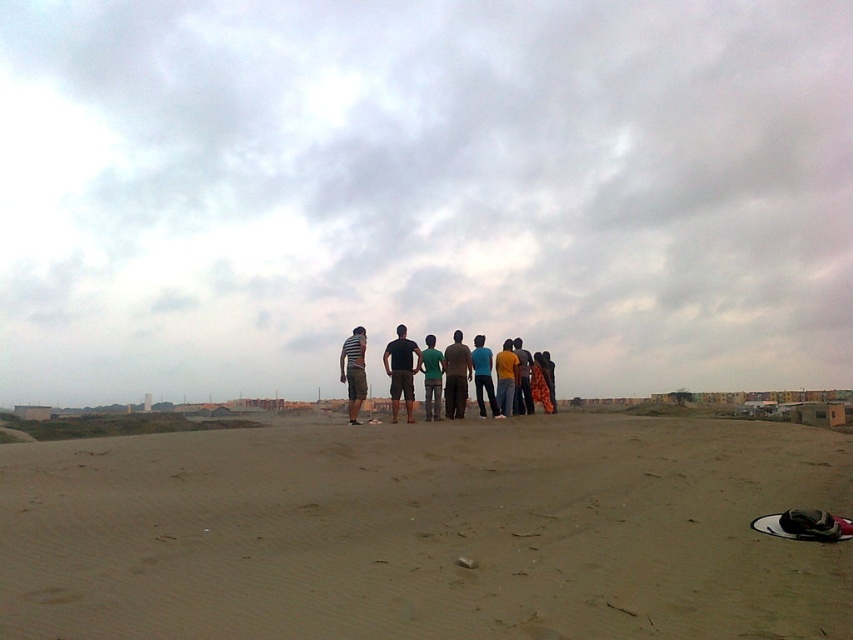
You are a photographer trying to capture the entire group of people in the image. Since you want to ensure the smooth sand at center and the dark gray fabric pants at center are both visible, which object should you focus on to include both in the frame?

The smooth sand at center is bigger than dark gray fabric pants at center, so focusing on the smooth sand at center will ensure both objects are visible in the frame since it occupies more space.

Looking at this image, you are a photographer trying to capture a clear shot of the dark gray fabric pants at center. However, the smooth sand at center is blocking your view. Can you adjust your position to avoid the sand and still see the pants?

The smooth sand at center is in front of the dark gray fabric pants at center, so moving your position to the side or behind the sand might allow you to see the pants without obstruction.

You are standing at the origin point of the coordinate system, which is the bottom left corner of the image. You want to walk towards the smooth sand at center. In which direction should you move relative to your current position?

The smooth sand at center is located at coordinate point 0.833 on the x axis and 0.501 on the y axis. Since you are at the origin point, you should move towards the right and slightly upwards to reach the smooth sand at center.